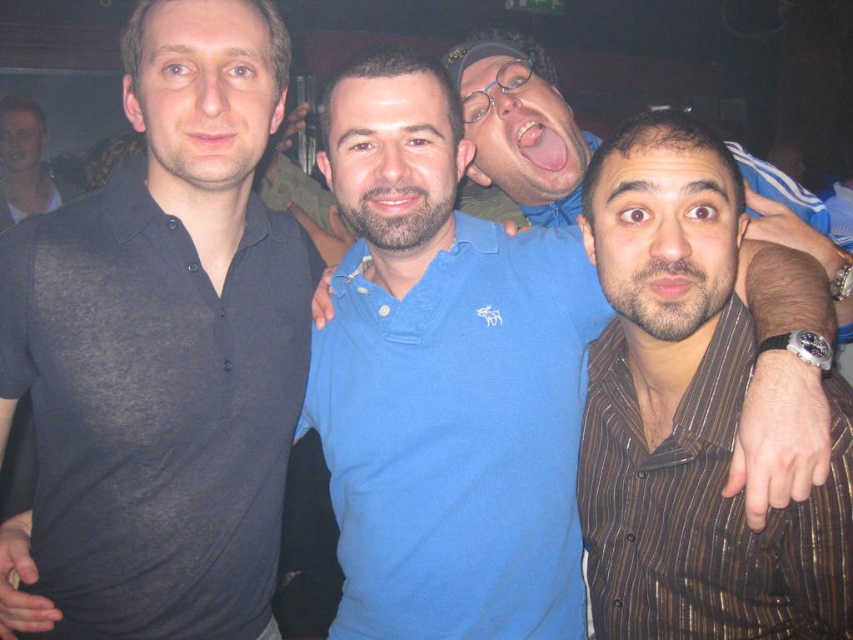
Describe the element at coordinates (166, 346) in the screenshot. I see `dark gray sheer shirt at left` at that location.

Based on the photo, can you confirm if dark gray sheer shirt at left is positioned to the left of brown striped shirt at center?

Yes, dark gray sheer shirt at left is to the left of brown striped shirt at center.

Who is more forward, (178, 435) or (749, 548)?

Positioned in front is point (749, 548).

Image resolution: width=853 pixels, height=640 pixels. I want to click on dark gray sheer shirt at left, so (166, 346).

Does blue cotton polo shirt at center have a larger size compared to brown striped shirt at center?

Yes, blue cotton polo shirt at center is bigger than brown striped shirt at center.

Is blue cotton polo shirt at center positioned before brown striped shirt at center?

That is False.

Find the location of a particular element. This screenshot has height=640, width=853. blue cotton polo shirt at center is located at coordinates (444, 384).

Can you confirm if dark gray sheer shirt at left is wider than blue cotton polo shirt at center?

No.

Is point (213, 401) closer to camera compared to point (512, 570)?

That is True.

Identify the location of dark gray sheer shirt at left. tap(166, 346).